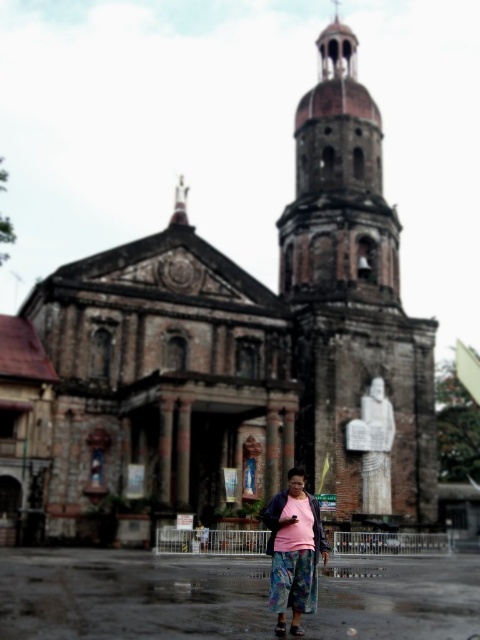
Consider the image. Is brown stone tower at center wider than brown stone bell tower at upper right?

Correct, the width of brown stone tower at center exceeds that of brown stone bell tower at upper right.

Who is higher up, brown stone tower at center or brown stone bell tower at upper right?

brown stone bell tower at upper right

Identify the location of brown stone tower at center. (354, 305).

Is brown stone tower at center above pink fabric at center?

Indeed, brown stone tower at center is positioned over pink fabric at center.

Does brown stone tower at center have a lesser width compared to pink fabric at center?

In fact, brown stone tower at center might be wider than pink fabric at center.

Where is `brown stone tower at center`? The width and height of the screenshot is (480, 640). brown stone tower at center is located at coordinates (354, 305).

Between brown stone bell tower at upper right and pink fabric at center, which one has less height?

Standing shorter between the two is pink fabric at center.

In the scene shown: Does brown stone bell tower at upper right have a smaller size compared to pink fabric at center?

Actually, brown stone bell tower at upper right might be larger than pink fabric at center.

The width and height of the screenshot is (480, 640). What do you see at coordinates (338, 182) in the screenshot?
I see `brown stone bell tower at upper right` at bounding box center [338, 182].

At what (x,y) coordinates should I click in order to perform the action: click on brown stone bell tower at upper right. Please return your answer as a coordinate pair (x, y). The image size is (480, 640). Looking at the image, I should click on (338, 182).